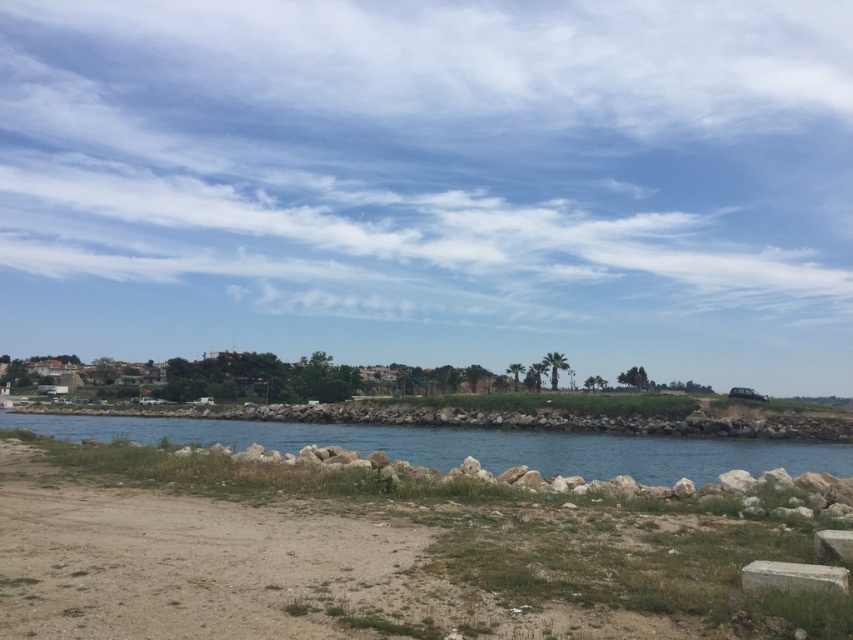
You are standing on the dull brown dirt at lower left and want to reach the blue stone water at center. Based on the scene, which direction should you move to get to the water?

The dull brown dirt at lower left has a lesser height compared to the blue stone water at center, so you should move upward to reach the water.

You are a gardener planning to plant a new flower bed between the dull brown dirt at lower left and the white marble stone at lower right. Which object should you start digging near to ensure the flower bed is between them?

You should start digging near the dull brown dirt at lower left because it is positioned on the left side of the white marble stone at lower right, so placing the flower bed between them would require starting from the dull brown dirt at lower left and moving towards the white marble stone at lower right.

You are standing at the origin point in the image. Where is the blue stone water at center located in terms of its 2D coordinates?

The blue stone water at center is located at the 2D coordinates of point (x=471, y=445).